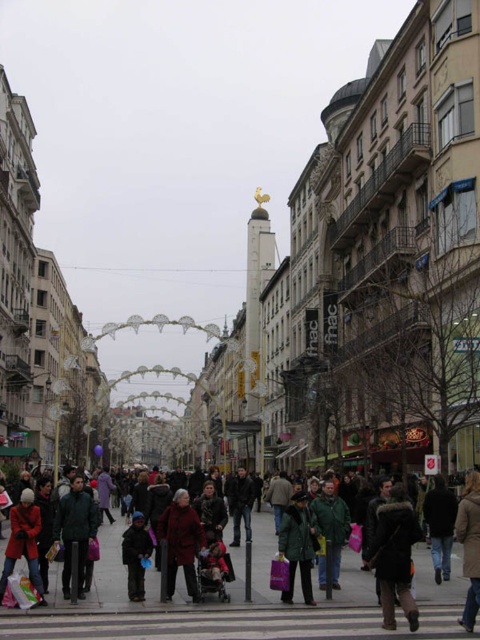
Is dark green jacket at center above matte red coat at lower left?

Indeed, dark green jacket at center is positioned over matte red coat at lower left.

Between point (80, 596) and point (37, 577), which one is positioned in front?

Point (37, 577)

Locate an element on the screen. dark green jacket at center is located at coordinates (74, 531).

Which is in front, point (337, 612) or point (29, 600)?

Point (337, 612) is more forward.

Can you confirm if dark green coat at center is shorter than translucent plastic bag at lower left?

In fact, dark green coat at center may be taller than translucent plastic bag at lower left.

Between point (110, 572) and point (26, 592), which one is positioned behind?

Point (110, 572)

Where is `dark green coat at center`? The height and width of the screenshot is (640, 480). dark green coat at center is located at coordinates (200, 605).

Is dark brown fur coat at center bigger than translucent plastic bag at lower left?

Indeed, dark brown fur coat at center has a larger size compared to translucent plastic bag at lower left.

Which is behind, point (393, 589) or point (26, 608)?

Point (26, 608)

Does point (380, 522) come in front of point (34, 604)?

No, it is behind (34, 604).

Locate an element on the screen. Image resolution: width=480 pixels, height=640 pixels. dark brown fur coat at center is located at coordinates (395, 556).